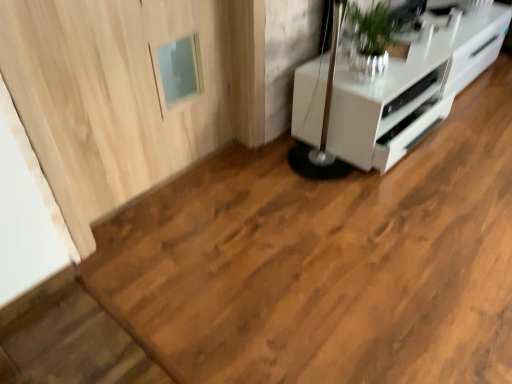
Find the location of a particular element. The image size is (512, 384). vacant region below green leafy plant at upper right (from a real-world perspective) is located at coordinates (376, 81).